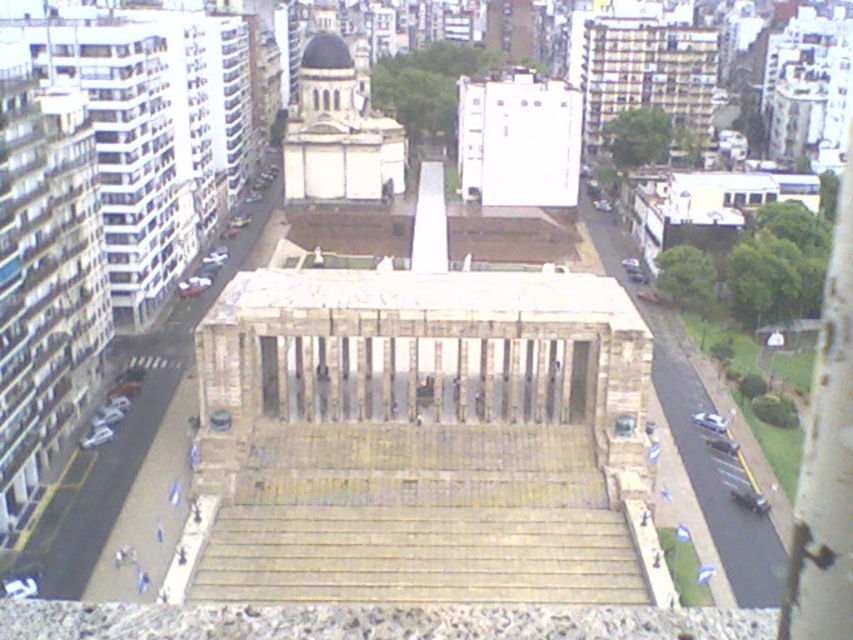
Question: Is smooth white pillar at right thinner than smooth dark blue dome at upper center?

Choices:
 (A) yes
 (B) no

Answer: (B)

Question: Which of the following is the farthest from the observer?

Choices:
 (A) (813, 435)
 (B) (350, 54)

Answer: (B)

Question: Can you confirm if smooth white pillar at right is bigger than smooth dark blue dome at upper center?

Choices:
 (A) yes
 (B) no

Answer: (A)

Question: Which point is closer to the camera?

Choices:
 (A) smooth white pillar at right
 (B) smooth dark blue dome at upper center

Answer: (A)

Question: Is smooth white pillar at right wider than smooth dark blue dome at upper center?

Choices:
 (A) no
 (B) yes

Answer: (B)

Question: Among these objects, which one is farthest from the camera?

Choices:
 (A) smooth white pillar at right
 (B) smooth dark blue dome at upper center

Answer: (B)